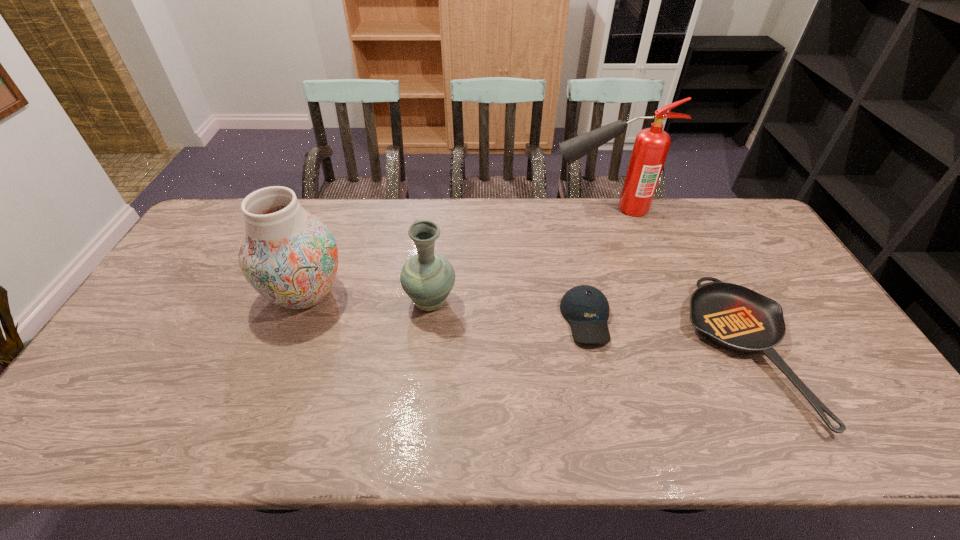
Identify the location of fire extinguisher. (651, 146).

This screenshot has width=960, height=540. I want to click on the farthest object, so click(651, 146).

Where is `vase`? The width and height of the screenshot is (960, 540). vase is located at coordinates (290, 257).

Find the location of `the fourth shortest object`. the fourth shortest object is located at coordinates (290, 257).

Identify the location of pitcher. This screenshot has width=960, height=540. (427, 277).

Find the location of a particular element. the fourth object from right to left is located at coordinates (427, 277).

Where is `baseball cap`? This screenshot has width=960, height=540. baseball cap is located at coordinates (586, 308).

Where is `the shortest object`? The width and height of the screenshot is (960, 540). the shortest object is located at coordinates (737, 318).

Identify the location of free region located at the nozzle of the fire extinguisher. The height and width of the screenshot is (540, 960). (468, 208).

What are the coordinates of `free location located at the nozzle of the fire extinguisher` in the screenshot? It's located at (537, 208).